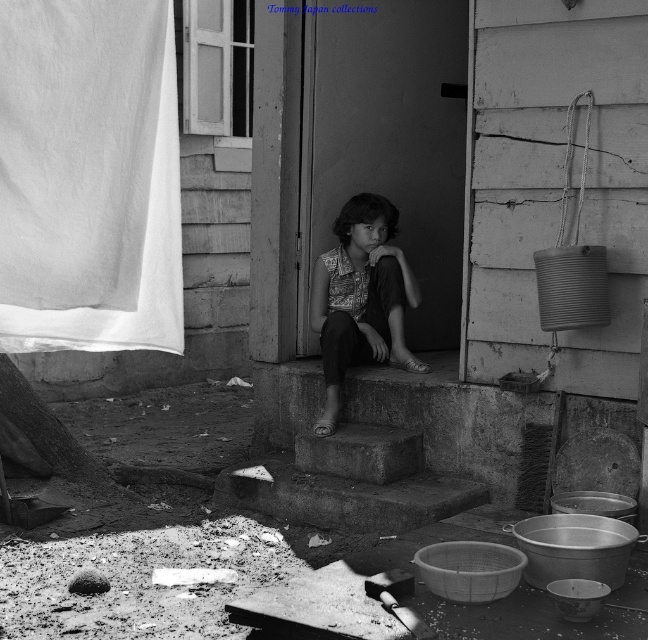
Question: Can you confirm if white cotton cloth at left is smaller than patterned fabric shirt at center?

Choices:
 (A) no
 (B) yes

Answer: (B)

Question: Which point is farther to the camera?

Choices:
 (A) (432, 506)
 (B) (422, 362)
 (C) (64, 326)

Answer: (B)

Question: Where is white cotton cloth at left located in relation to patterned fabric shirt at center in the image?

Choices:
 (A) left
 (B) right

Answer: (A)

Question: Which point is farther from the camera taking this photo?

Choices:
 (A) tap(316, 257)
 (B) tap(65, 16)

Answer: (A)

Question: Does white cotton cloth at left appear on the right side of concrete stairs at center?

Choices:
 (A) no
 (B) yes

Answer: (A)

Question: Considering the real-world distances, which object is farthest from the patterned fabric shirt at center?

Choices:
 (A) concrete stairs at center
 (B) white cotton cloth at left

Answer: (B)